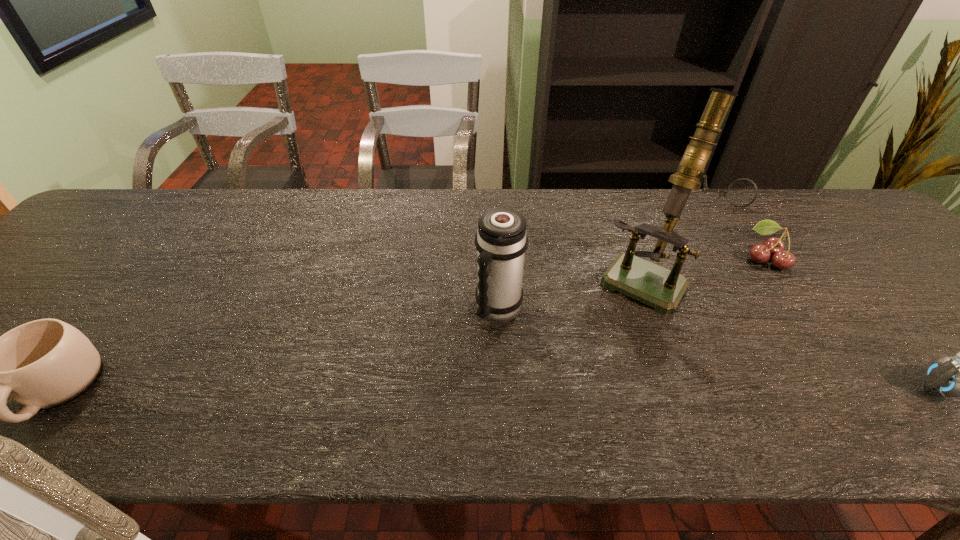
Locate an element on the screen. The image size is (960, 540). free point located on the leaves of the cherry is located at coordinates (654, 328).

What are the coordinates of `vacant area situated 0.100m on the side with the handle of the fourth object from right to left` in the screenshot? It's located at (473, 361).

Locate an element on the screen. vacant space situated 0.060m on the side with the handle of the fourth object from right to left is located at coordinates (480, 347).

Where is `free space at the far edge of the desktop`? This screenshot has height=540, width=960. free space at the far edge of the desktop is located at coordinates (567, 236).

Where is `free region at the near edge of the desktop`? free region at the near edge of the desktop is located at coordinates coord(733,374).

Where is `vacant space at the left edge of the desktop`? vacant space at the left edge of the desktop is located at coordinates (74, 303).

This screenshot has width=960, height=540. What are the coordinates of `vacant area at the right edge of the desktop` in the screenshot? It's located at (879, 286).

Identify which object is the second closest to the thermos bottle. Please provide its 2D coordinates. Your answer should be formatted as a tuple, i.e. [(x, y)], where the tuple contains the x and y coordinates of a point satisfying the conditions above.

[(760, 253)]

Where is `object that ranks as the fourth closest to the mug`? Image resolution: width=960 pixels, height=540 pixels. object that ranks as the fourth closest to the mug is located at coordinates (949, 376).